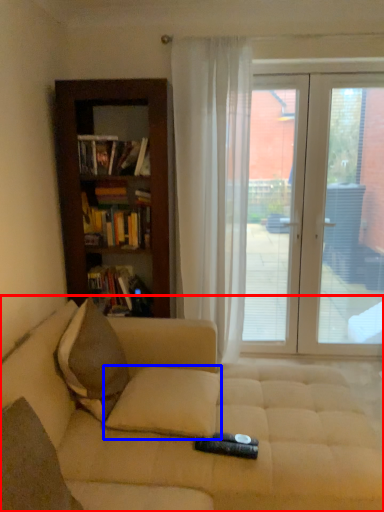
Question: Which object appears closest to the camera in this image, studio couch (highlighted by a red box) or pillow (highlighted by a blue box)?

Choices:
 (A) studio couch
 (B) pillow

Answer: (A)